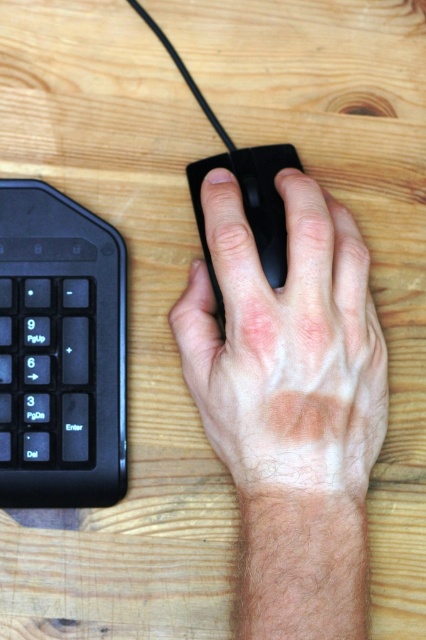
Question: From the image, what is the correct spatial relationship of smooth matte black mouse at center in relation to black matte keyboard at lower left?

Choices:
 (A) left
 (B) right

Answer: (B)

Question: Can you confirm if smooth matte black mouse at center is positioned to the left of black matte keyboard at lower left?

Choices:
 (A) yes
 (B) no

Answer: (B)

Question: Which object is positioned closest to the smooth matte black mouse at center?

Choices:
 (A) black matte keyboard at lower left
 (B) black matte mouse at center

Answer: (B)

Question: Is smooth matte black mouse at center closer to camera compared to black matte mouse at center?

Choices:
 (A) no
 (B) yes

Answer: (B)

Question: Among these points, which one is farthest from the camera?

Choices:
 (A) pyautogui.click(x=5, y=452)
 (B) pyautogui.click(x=281, y=163)
 (C) pyautogui.click(x=293, y=403)

Answer: (B)

Question: Estimate the real-world distances between objects in this image. Which object is farther from the black matte mouse at center?

Choices:
 (A) black matte keyboard at lower left
 (B) smooth matte black mouse at center

Answer: (A)